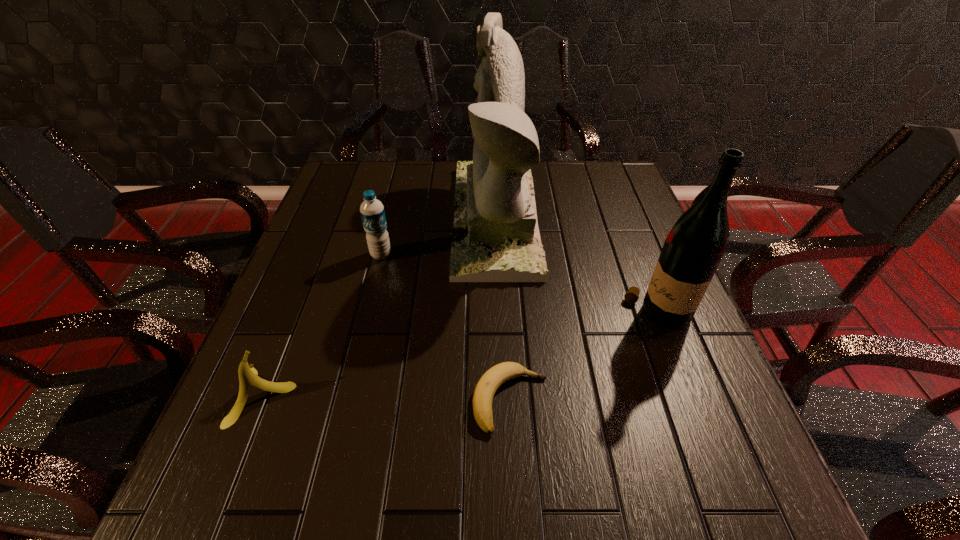
Locate an element on the screen. sculpture is located at coordinates (495, 238).

I want to click on the third farthest object, so click(x=693, y=249).

At what (x,y) coordinates should I click in order to perform the action: click on the second tallest object. Please return your answer as a coordinate pair (x, y). The width and height of the screenshot is (960, 540). Looking at the image, I should click on (693, 249).

Find the location of a particular element. The height and width of the screenshot is (540, 960). the fourth object from right to left is located at coordinates tap(372, 212).

This screenshot has height=540, width=960. I want to click on the third tallest object, so click(372, 212).

Identify the location of the second shortest object. This screenshot has height=540, width=960. (247, 374).

Locate an element on the screen. The image size is (960, 540). the leftmost object is located at coordinates (247, 374).

Locate an element on the screen. The image size is (960, 540). the shorter banana is located at coordinates (485, 389).

Identify the location of the right banana. (485, 389).

The width and height of the screenshot is (960, 540). I want to click on free space located on the base of the sculpture, so click(419, 218).